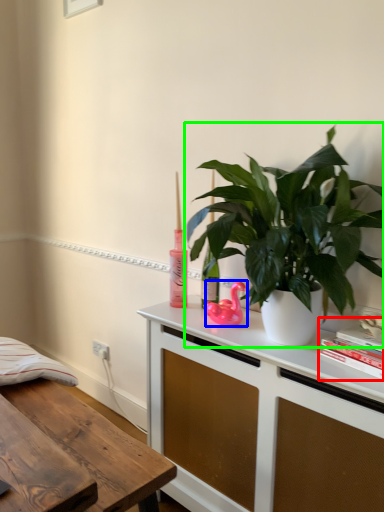
Question: Estimate the real-world distances between objects in this image. Which object is closer to book (highlighted by a red box), appliance (highlighted by a blue box) or houseplant (highlighted by a green box)?

Choices:
 (A) appliance
 (B) houseplant

Answer: (B)